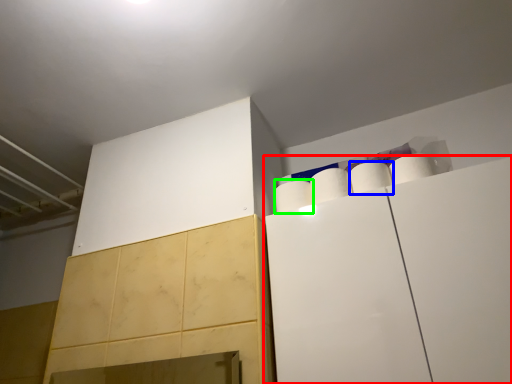
Question: Which object is the closest to the cabinetry (highlighted by a red box)? Choose among these: paper towel (highlighted by a blue box) or paper towel (highlighted by a green box).

Choices:
 (A) paper towel
 (B) paper towel

Answer: (A)